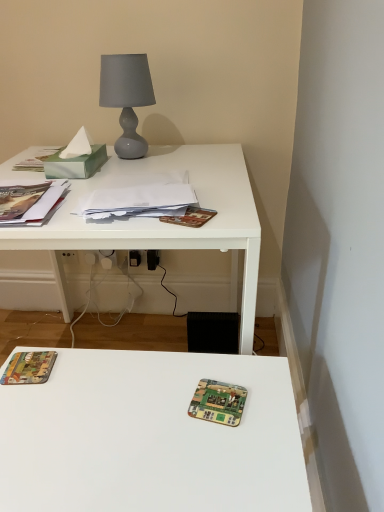
Locate an element on the screen. The image size is (384, 512). free spot above white paper stack at center (from a real-world perspective) is located at coordinates (139, 194).